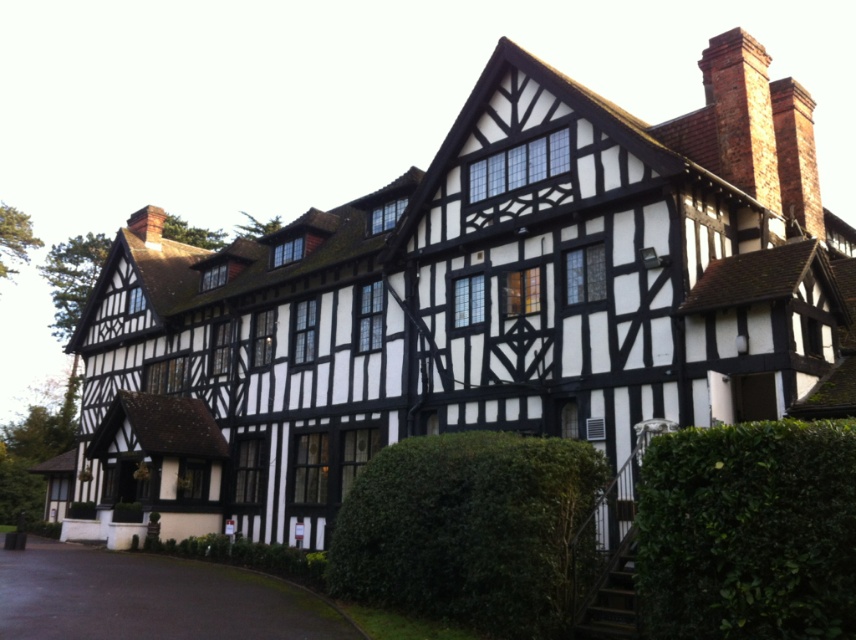
You are standing in front of the half timbered building and see two points marked on the building. The first point is at coordinate point (696, 604) and the second is at point (761, 54). Which point is closer to you?

Point (696, 604) is in front of point (761, 54), so it is closer to you.

Based on the photo, you are standing in front of the half timbered building and want to take a closer look at the green leafy hedge at lower right and the brick chimney at upper right. Which object is nearer to you?

The green leafy hedge at lower right is closer to the viewer than the brick chimney at upper right.